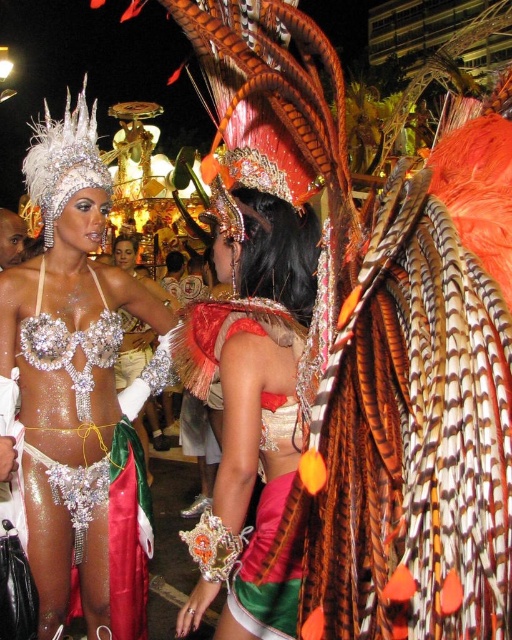
You are a photographer standing at the point marked as point (x=8, y=369). You want to capture a wide shot of the two performers in the parade. Given that your camera has a maximum zoom range of 50 meters, will you be able to frame both performers in a single shot without moving?

The two performers are 43.63 meters apart. Since your camera can zoom up to 50 meters, you can frame both performers in a single shot without moving.

You are a costume designer trying to fit a new accessory between the shiny silver bikini top at center and the shiny metallic bikini top at center. Which bikini top has a greater width to allow more space for the accessory?

The shiny silver bikini top at center has a greater width than the shiny metallic bikini top at center, so it would allow more space for the accessory.